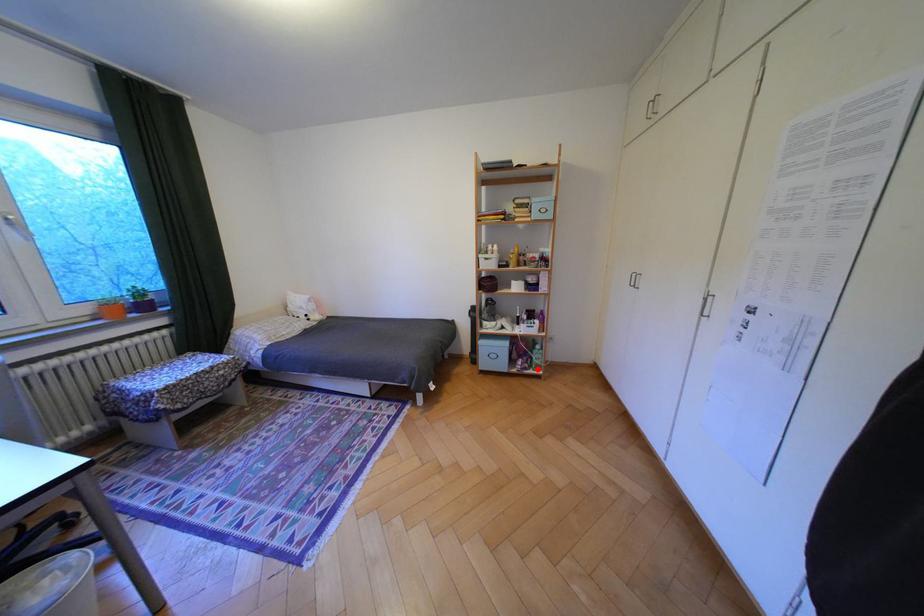
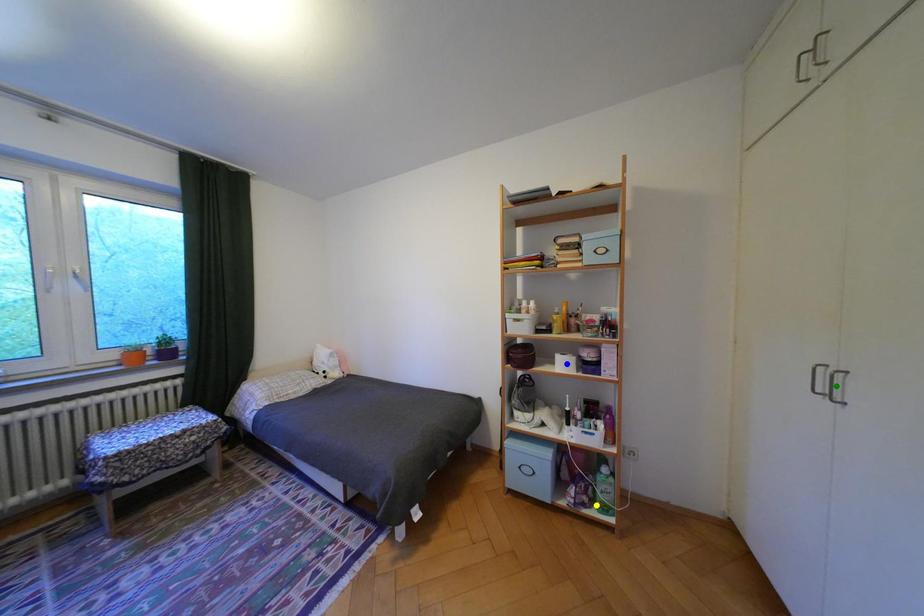
Question: I am providing you with two images of the same scene from different viewpoints. A red point is marked on the first image. You are given multiple points on the second image. Can you choose the point in image 2 that corresponds to the point in image 1?

Choices:
 (A) yellow point
 (B) blue point
 (C) green point

Answer: (A)